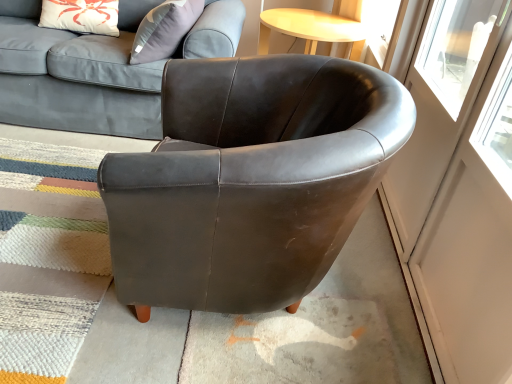
Question: Is matte gray fabric couch at upper left positioned in front of transparent glass screen door at right?

Choices:
 (A) yes
 (B) no

Answer: (B)

Question: From the image's perspective, is matte gray fabric couch at upper left on transparent glass screen door at right?

Choices:
 (A) no
 (B) yes

Answer: (B)

Question: Is matte gray fabric couch at upper left not near transparent glass screen door at right?

Choices:
 (A) no
 (B) yes

Answer: (B)

Question: Can you confirm if matte gray fabric couch at upper left is shorter than transparent glass screen door at right?

Choices:
 (A) yes
 (B) no

Answer: (A)

Question: Considering the relative sizes of matte gray fabric couch at upper left and transparent glass screen door at right in the image provided, is matte gray fabric couch at upper left bigger than transparent glass screen door at right?

Choices:
 (A) no
 (B) yes

Answer: (B)

Question: Is matte brown leather armchair at center taller or shorter than transparent glass screen door at right?

Choices:
 (A) short
 (B) tall

Answer: (A)

Question: Considering the positions of point (245, 225) and point (458, 268), is point (245, 225) closer or farther from the camera than point (458, 268)?

Choices:
 (A) closer
 (B) farther

Answer: (A)

Question: Relative to transparent glass screen door at right, is matte brown leather armchair at center in front or behind?

Choices:
 (A) front
 (B) behind

Answer: (B)

Question: From a real-world perspective, is matte brown leather armchair at center above or below transparent glass screen door at right?

Choices:
 (A) below
 (B) above

Answer: (A)

Question: In terms of height, does matte gray fabric couch at upper left look taller or shorter compared to matte brown leather armchair at center?

Choices:
 (A) tall
 (B) short

Answer: (A)

Question: Is matte gray fabric couch at upper left to the left or to the right of matte brown leather armchair at center in the image?

Choices:
 (A) left
 (B) right

Answer: (A)

Question: Is matte gray fabric couch at upper left inside the boundaries of matte brown leather armchair at center, or outside?

Choices:
 (A) inside
 (B) outside

Answer: (B)

Question: Looking at their shapes, would you say matte gray fabric couch at upper left is wider or thinner than matte brown leather armchair at center?

Choices:
 (A) wide
 (B) thin

Answer: (A)

Question: Is transparent glass screen door at right taller or shorter than matte brown leather armchair at center?

Choices:
 (A) tall
 (B) short

Answer: (A)

Question: From the image's perspective, is transparent glass screen door at right above or below matte brown leather armchair at center?

Choices:
 (A) below
 (B) above

Answer: (A)